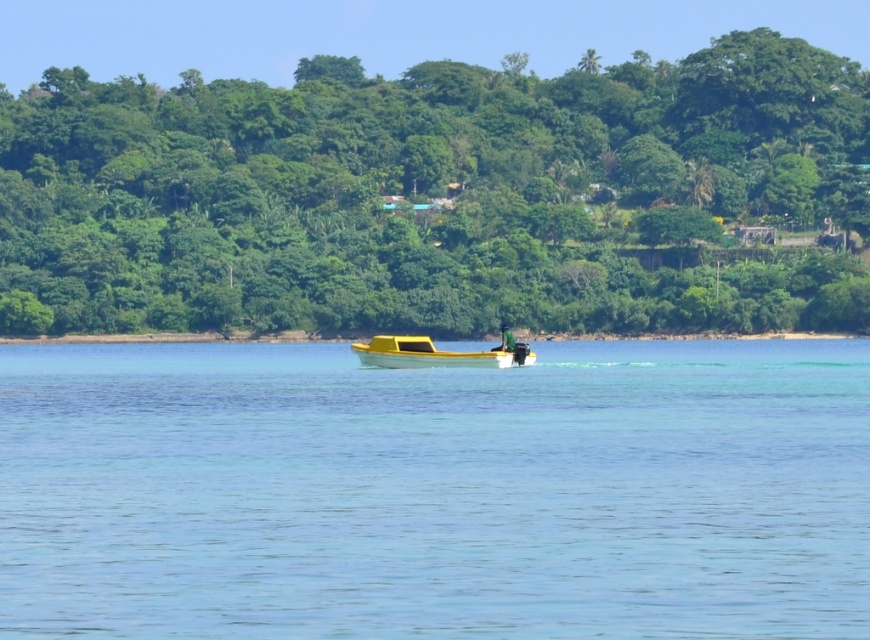
Question: Can you confirm if clear blue water at center is positioned above green leafy tree at center?

Choices:
 (A) no
 (B) yes

Answer: (A)

Question: Which of these objects is positioned farthest from the yellow matte boat at center?

Choices:
 (A) green leafy tree at center
 (B) clear blue water at center

Answer: (A)

Question: Can you confirm if green leafy tree at center is wider than yellow matte boat at center?

Choices:
 (A) no
 (B) yes

Answer: (B)

Question: From the image, what is the correct spatial relationship of clear blue water at center in relation to yellow matte boat at center?

Choices:
 (A) below
 (B) above

Answer: (A)

Question: Based on their relative distances, which object is farther from the clear blue water at center?

Choices:
 (A) yellow matte boat at center
 (B) green leafy tree at center

Answer: (B)

Question: Which point is farther to the camera?

Choices:
 (A) (526, 364)
 (B) (763, 122)

Answer: (B)